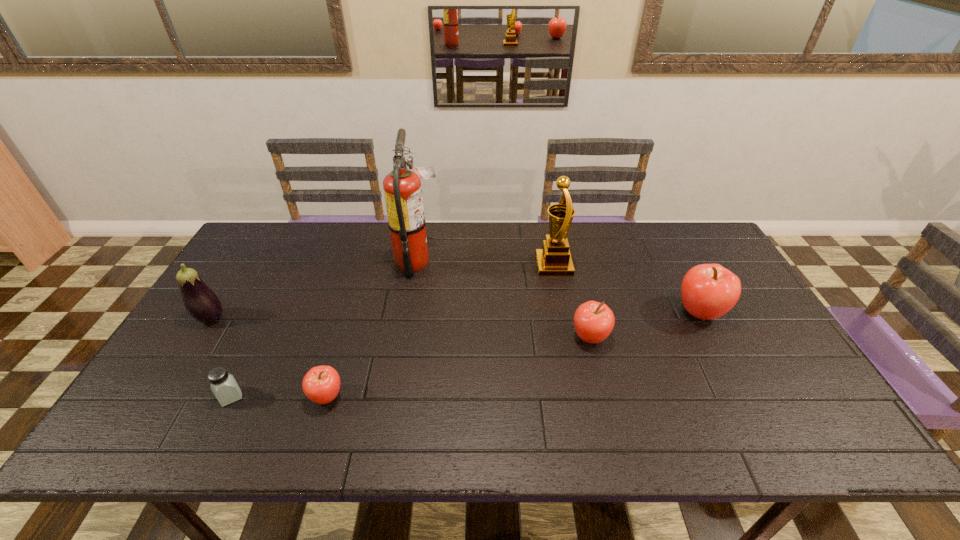
Where is `free space for an extra apple to achieve even spacing`? free space for an extra apple to achieve even spacing is located at coordinates pyautogui.click(x=467, y=365).